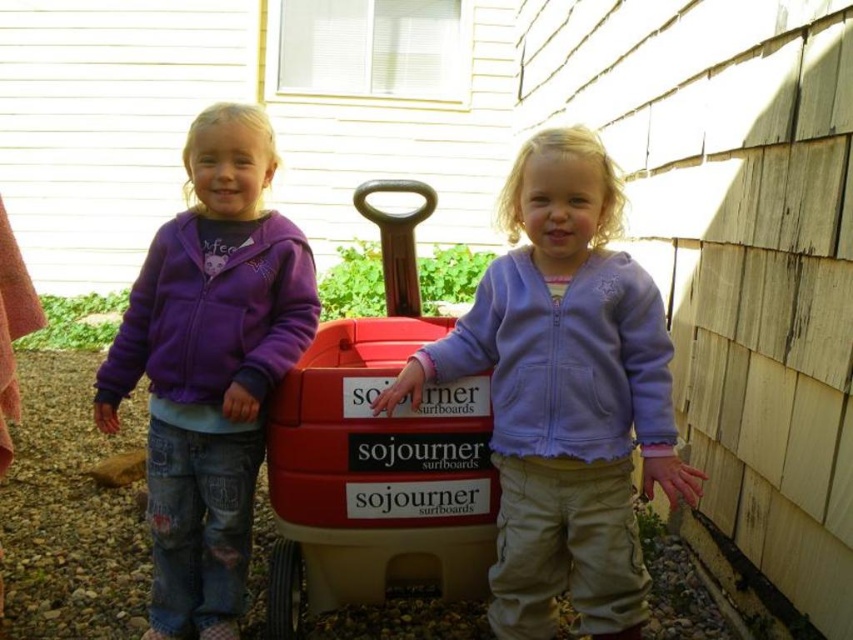
You are a parent trying to decide whether to let your child take the purple fleece jacket at center and the red plastic toy car at center on a car ride. Considering their sizes, which item will require more space in the car trunk?

The purple fleece jacket at center is much taller than the red plastic toy car at center, so it will require more space in the car trunk.